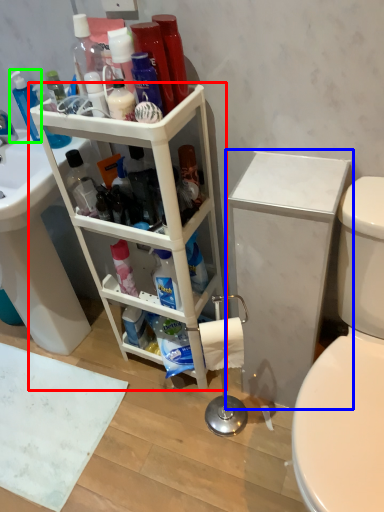
Question: Which object is positioned closest to shelf (highlighted by a red box)? Select from bathroom cabinet (highlighted by a blue box) and cleaning product (highlighted by a green box).

Choices:
 (A) bathroom cabinet
 (B) cleaning product

Answer: (A)